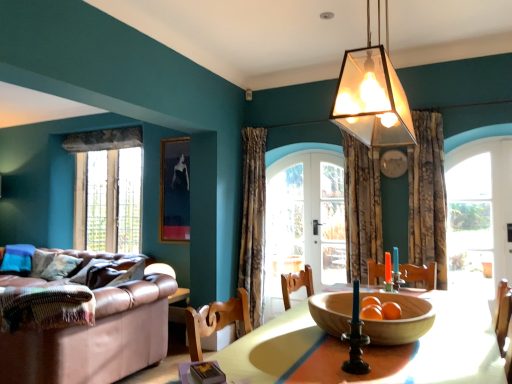
Question: Based on their sizes in the image, would you say clear glass window at right, arranged as the first window when viewed from the right, is bigger or smaller than clear glass window at left, marked as the second window in a right-to-left arrangement?

Choices:
 (A) big
 (B) small

Answer: (B)

Question: From the image's perspective, is clear glass window at right, acting as the second window starting from the back, positioned above or below clear glass window at left, positioned as the 1th window in left-to-right order?

Choices:
 (A) below
 (B) above

Answer: (A)

Question: Which object is positioned closest to the leather couch at left?

Choices:
 (A) clear glass window at left, the 1th window from the back
 (B) translucent glass pendant light at upper center
 (C) floral fabric curtain at center, positioned as the 2th curtain in right-to-left order
 (D) clear glass door at center
 (E) wooden table at center

Answer: (D)

Question: Considering the real-world distances, which object is farthest from the textured floral fabric curtain at center, the first curtain positioned from the right?

Choices:
 (A) wooden bowl at center
 (B) translucent glass pendant light at upper center
 (C) leather couch at left
 (D) floral fabric curtain at center, which is the third curtain in right-to-left order
 (E) clear glass window at left, the 1th window from the back

Answer: (E)